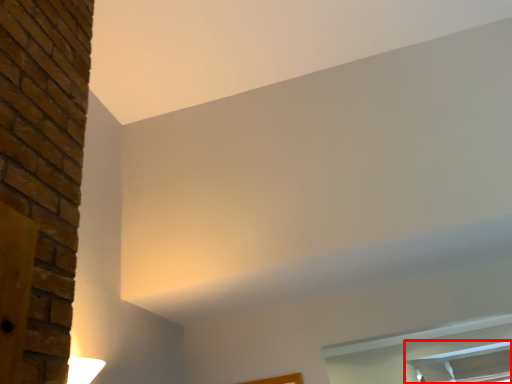
Question: In this image, where is window (annotated by the red box) located relative to window?

Choices:
 (A) left
 (B) right

Answer: (B)